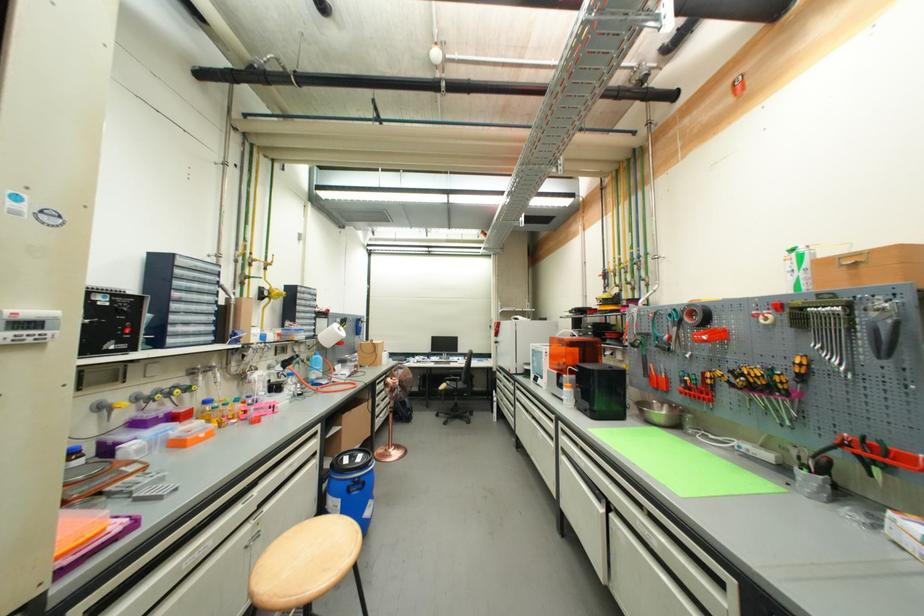
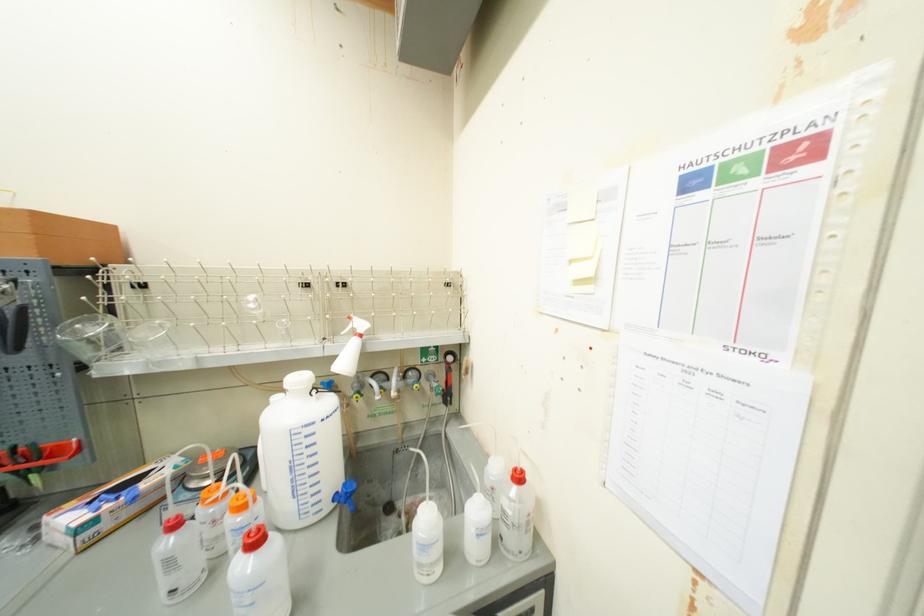
Question: The camera is either moving clockwise (left) or counter-clockwise (right) around the object. The first image is from the beginning of the video and the second image is from the end. Is the camera moving left or right when shooting the video?

Choices:
 (A) Left
 (B) Right

Answer: (A)